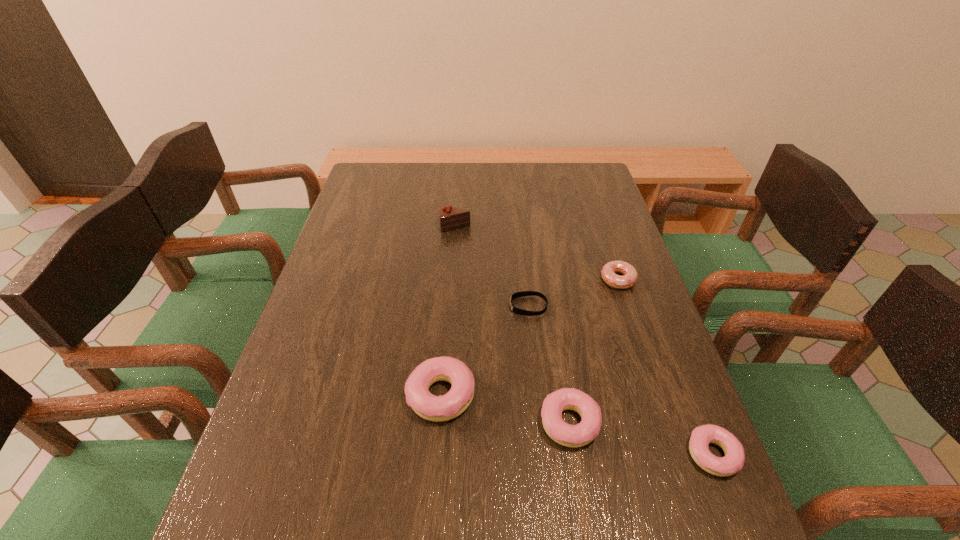
Locate an element on the screen. free space at the right edge of the desktop is located at coordinates (644, 399).

Identify the location of vacant region at the far left corner. (356, 187).

I want to click on vacant space at the far right corner of the desktop, so click(x=560, y=179).

In the image, there is a desktop. What are the coordinates of `vacant area at the near right corner` in the screenshot? It's located at (647, 469).

You are a GUI agent. You are given a task and a screenshot of the screen. Output one action in this format:
    pyautogui.click(x=<x>, y=<y>)
    Task: Click on the vacant area between the fifth nearest object and the second tallest object
    The height and width of the screenshot is (540, 960).
    Given the screenshot: What is the action you would take?
    pyautogui.click(x=529, y=337)

Identify the location of unoccupied position between the leftmost doughnut and the farthest doughnut. This screenshot has height=540, width=960. (529, 337).

I want to click on vacant space that is in between the farthest object and the farthest doughnut, so click(537, 253).

Image resolution: width=960 pixels, height=540 pixels. Identify the location of empty space that is in between the fifth shortest object and the farthest doughnut. (529, 337).

At what (x,y) coordinates should I click in order to perform the action: click on unoccupied area between the tallest object and the farthest doughnut. Please return your answer as a coordinate pair (x, y). The width and height of the screenshot is (960, 540). Looking at the image, I should click on (537, 253).

Locate an element on the screen. free area in between the farthest doughnut and the fifth shortest object is located at coordinates (529, 337).